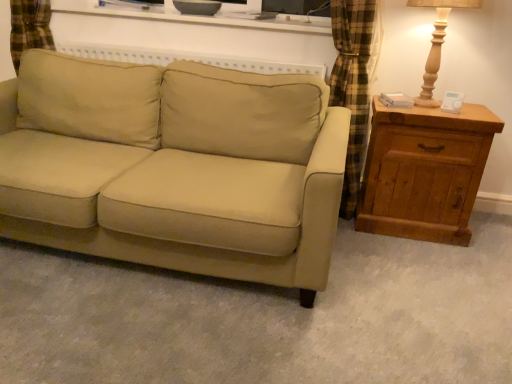
Question: Considering the relative positions of wooden table lamp at right and wooden chest of drawers at right in the image provided, is wooden table lamp at right behind wooden chest of drawers at right?

Choices:
 (A) no
 (B) yes

Answer: (A)

Question: From the image's perspective, does wooden table lamp at right appear higher than wooden chest of drawers at right?

Choices:
 (A) no
 (B) yes

Answer: (B)

Question: Is wooden table lamp at right far from wooden chest of drawers at right?

Choices:
 (A) no
 (B) yes

Answer: (A)

Question: Does wooden table lamp at right touch wooden chest of drawers at right?

Choices:
 (A) no
 (B) yes

Answer: (A)

Question: Does wooden table lamp at right have a larger size compared to wooden chest of drawers at right?

Choices:
 (A) yes
 (B) no

Answer: (B)

Question: In terms of height, does wooden chest of drawers at right look taller or shorter compared to wooden table lamp at right?

Choices:
 (A) tall
 (B) short

Answer: (A)

Question: Choose the correct answer: Is wooden chest of drawers at right inside wooden table lamp at right or outside it?

Choices:
 (A) inside
 (B) outside

Answer: (B)

Question: Is point click(389, 155) closer or farther from the camera than point click(433, 52)?

Choices:
 (A) farther
 (B) closer

Answer: (A)

Question: In terms of size, does wooden chest of drawers at right appear bigger or smaller than wooden table lamp at right?

Choices:
 (A) small
 (B) big

Answer: (B)

Question: Considering the positions of beige fabric couch at center and wooden chest of drawers at right in the image, is beige fabric couch at center wider or thinner than wooden chest of drawers at right?

Choices:
 (A) thin
 (B) wide

Answer: (B)

Question: From the image's perspective, relative to wooden chest of drawers at right, is beige fabric couch at center above or below?

Choices:
 (A) below
 (B) above

Answer: (B)

Question: Which is correct: beige fabric couch at center is inside wooden chest of drawers at right, or outside of it?

Choices:
 (A) inside
 (B) outside

Answer: (B)

Question: From their relative heights in the image, would you say beige fabric couch at center is taller or shorter than wooden chest of drawers at right?

Choices:
 (A) tall
 (B) short

Answer: (A)

Question: In terms of width, does wooden table lamp at right look wider or thinner when compared to wooden chest of drawers at right?

Choices:
 (A) wide
 (B) thin

Answer: (B)

Question: In the image, is wooden table lamp at right on the left side or the right side of wooden chest of drawers at right?

Choices:
 (A) left
 (B) right

Answer: (A)